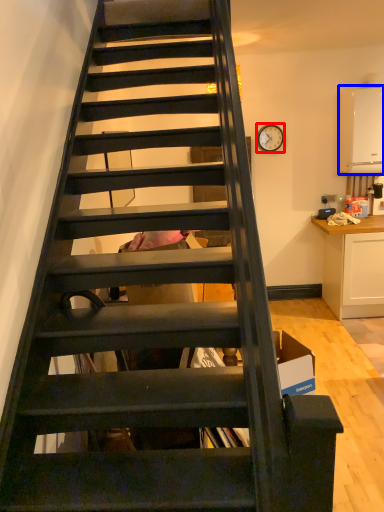
Question: Which object appears closest to the camera in this image, clock (highlighted by a red box) or appliance (highlighted by a blue box)?

Choices:
 (A) clock
 (B) appliance

Answer: (B)